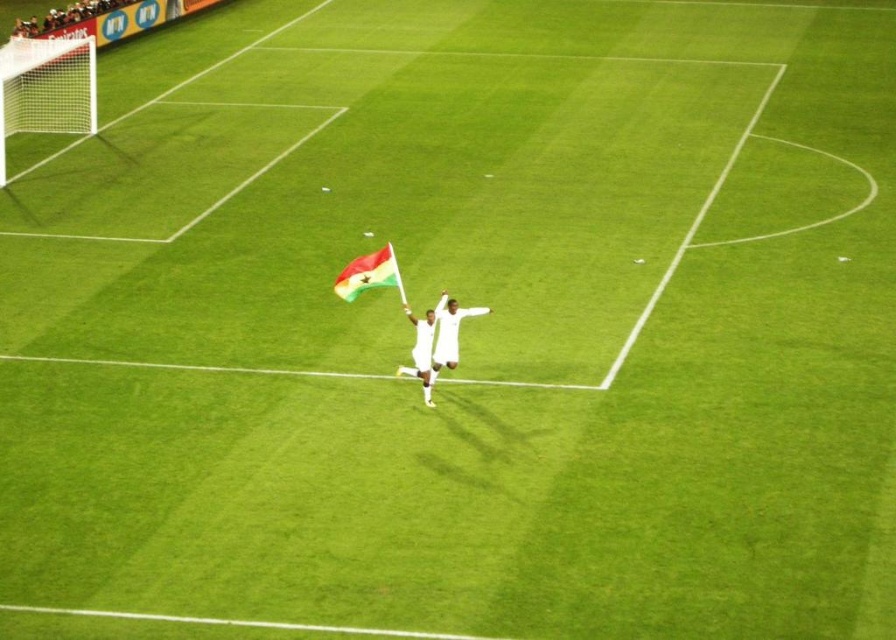
Question: Does green fabric flag at center appear under white fabric at center?

Choices:
 (A) yes
 (B) no

Answer: (B)

Question: Which object is positioned farthest from the white fabric flag at center?

Choices:
 (A) white plastic goal at upper left
 (B) white fabric at center

Answer: (A)

Question: Considering the real-world distances, which object is farthest from the white fabric at center?

Choices:
 (A) green fabric flag at center
 (B) white plastic goal at upper left
 (C) white fabric flag at center

Answer: (B)

Question: Which point is closer to the camera?

Choices:
 (A) white fabric flag at center
 (B) white plastic goal at upper left
 (C) white fabric at center
 (D) green fabric flag at center

Answer: (A)

Question: Where is white fabric at center located in relation to white fabric flag at center in the image?

Choices:
 (A) below
 (B) above

Answer: (B)

Question: Does green fabric flag at center appear on the right side of white fabric flag at center?

Choices:
 (A) no
 (B) yes

Answer: (A)